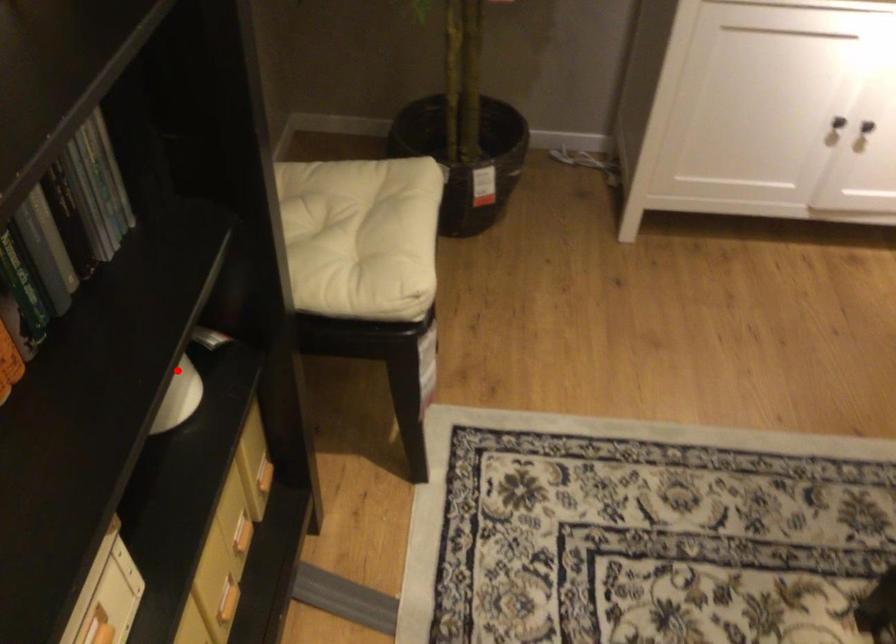
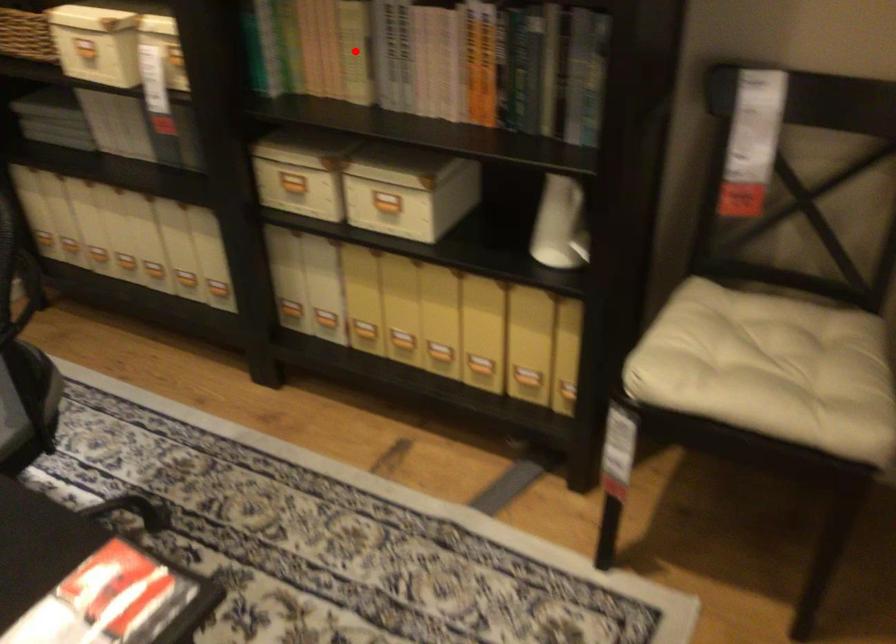
I am providing you with two images of the same scene from different viewpoints. A red point is marked on the first image and another point is marked on the second image. Does the point marked in image1 correspond to the same location as the one in image2?

No